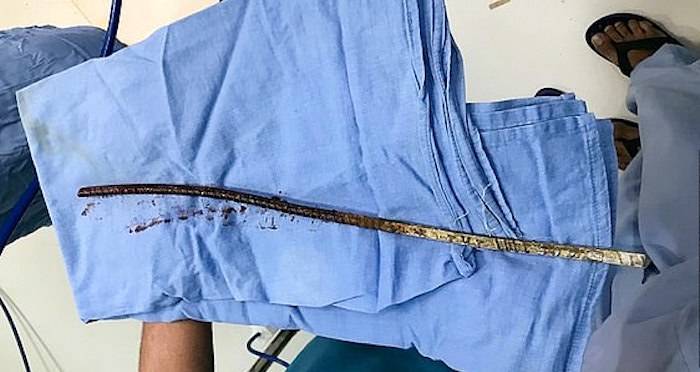
The width and height of the screenshot is (700, 372). Identify the location of floor. (498, 69).